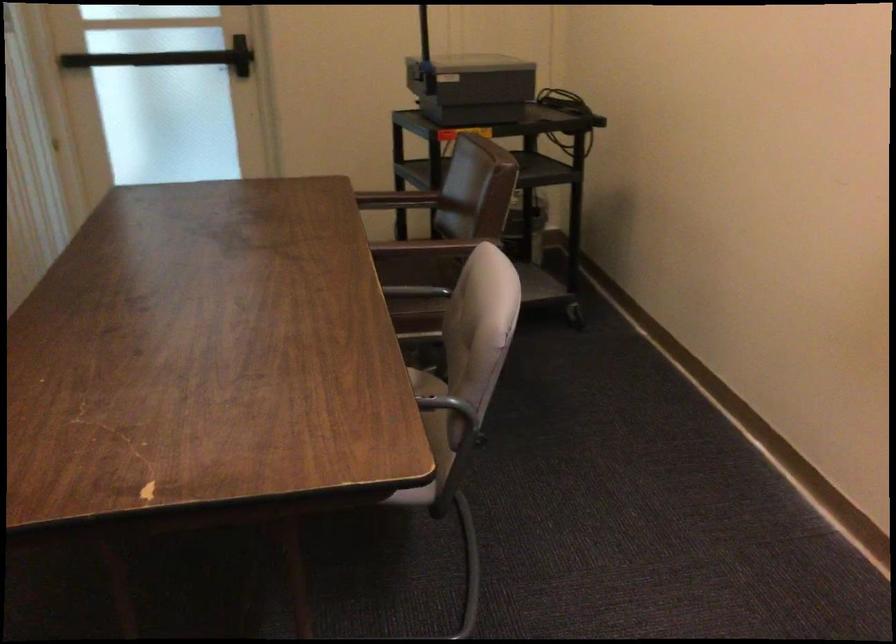
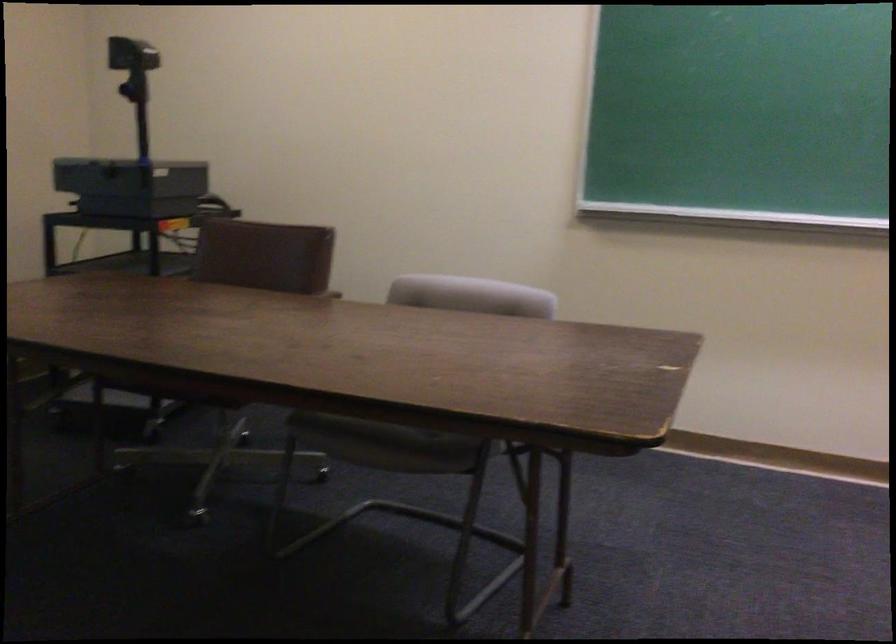
The point at (434, 78) is marked in the first image. Where is the corresponding point in the second image?

(131, 180)